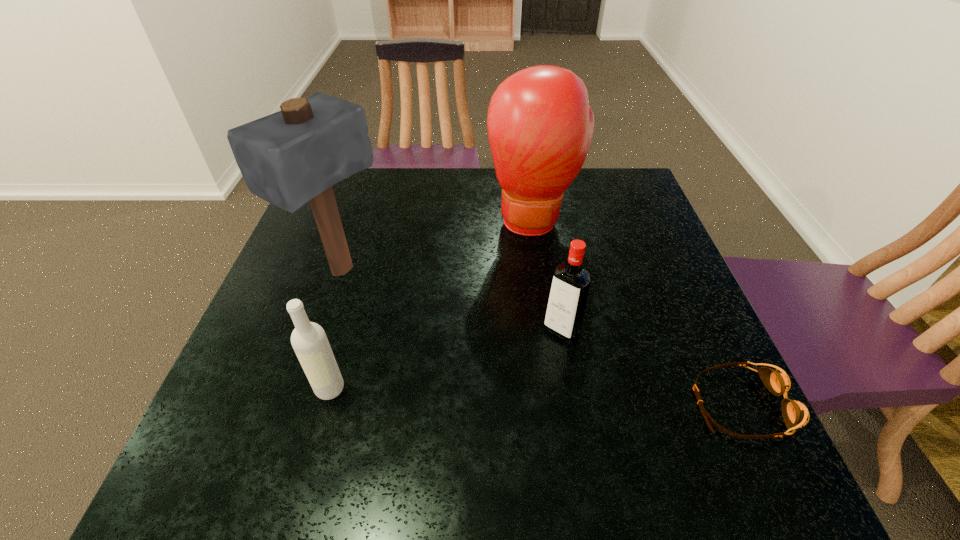
Locate which object is the fourth closest to the mallet. Please provide its 2D coordinates. Your answer should be formatted as a tuple, i.e. [(x, y)], where the tuple contains the x and y coordinates of a point satisfying the conditions above.

[(795, 414)]

Select which object is the fourth closest to the boxing glove. Please provide its 2D coordinates. Your answer should be formatted as a tuple, i.e. [(x, y)], where the tuple contains the x and y coordinates of a point satisfying the conditions above.

[(309, 341)]

Where is `free location that satisfies the following two spatial constraints: 1. on the front side of the boxing glove; 2. on the left side of the right vodka`? The width and height of the screenshot is (960, 540). free location that satisfies the following two spatial constraints: 1. on the front side of the boxing glove; 2. on the left side of the right vodka is located at coordinates (550, 329).

In order to click on free space that satisfies the following two spatial constraints: 1. on the front side of the shortest object; 2. with the lenses facing forward on the farther vodka in this screenshot , I will do `click(575, 404)`.

The width and height of the screenshot is (960, 540). Identify the location of free space that satisfies the following two spatial constraints: 1. on the front side of the farther vodka; 2. on the right side of the mallet. (322, 329).

Identify the location of vacant space that satisfies the following two spatial constraints: 1. on the front side of the rightmost object; 2. with the lenses facing forward on the mallet. (297, 404).